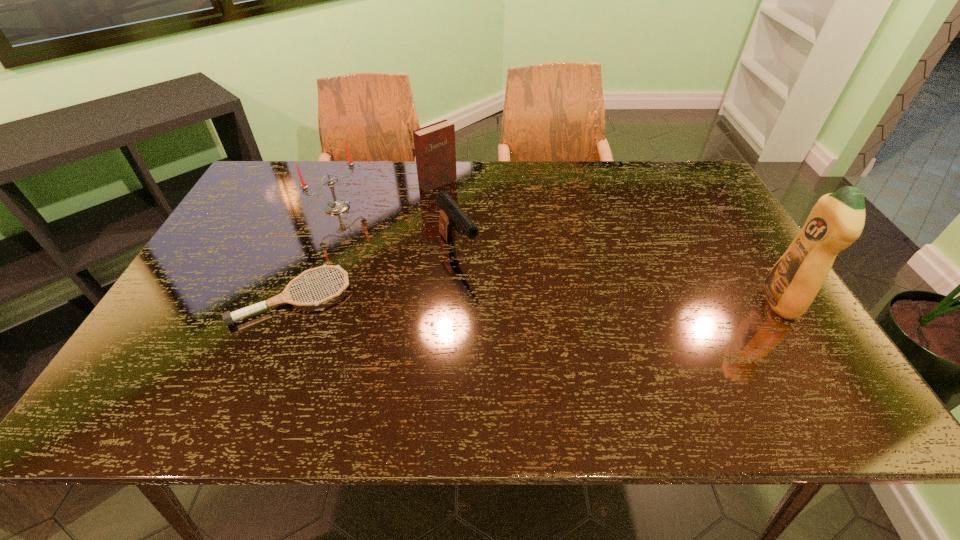
You are a GUI agent. You are given a task and a screenshot of the screen. Output one action in this format:
    pyautogui.click(x=<x>, y=<y>)
    Task: Click on the tennis racket
    
    Given the screenshot: What is the action you would take?
    pyautogui.click(x=228, y=317)

At what (x,y) coordinates should I click in order to perform the action: click on the rightmost object. Please return your answer as a coordinate pair (x, y). The width and height of the screenshot is (960, 540). Looking at the image, I should click on (837, 219).

The width and height of the screenshot is (960, 540). Identify the location of detergent. (837, 219).

Find the location of a particular element. This screenshot has height=540, width=960. the second shortest object is located at coordinates (451, 214).

Locate an element on the screen. candle is located at coordinates (336, 206).

You are a GUI agent. You are given a task and a screenshot of the screen. Output one action in this format:
    pyautogui.click(x=<x>, y=<y>)
    Task: Click on the diary
    The image size is (960, 540).
    Given the screenshot: What is the action you would take?
    pyautogui.click(x=435, y=152)

Locate an element on the screen. The height and width of the screenshot is (540, 960). vacant space positioned on the back of the shortest object is located at coordinates (330, 206).

This screenshot has width=960, height=540. Identify the location of free region located 0.400m on the label of the tallest object. (599, 301).

The width and height of the screenshot is (960, 540). I want to click on vacant space located on the label of the tallest object, so click(685, 301).

This screenshot has width=960, height=540. Identify the location of vacant region located 0.170m on the label of the tallest object. (694, 301).